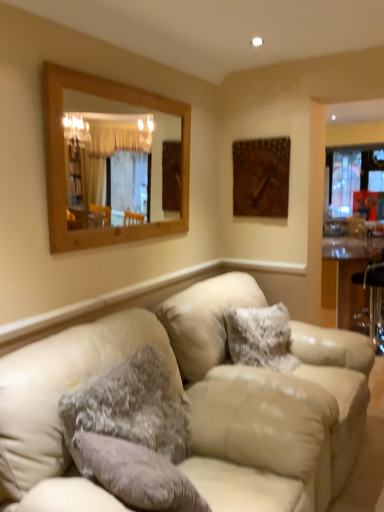
Question: Is brown wooden picture frame at upper right outside fuzzy gray pillow at center, the second pillow from the back?

Choices:
 (A) yes
 (B) no

Answer: (A)

Question: Is brown wooden picture frame at upper right closer to the viewer compared to fuzzy gray pillow at center, placed as the second pillow when sorted from right to left?

Choices:
 (A) yes
 (B) no

Answer: (B)

Question: Is brown wooden picture frame at upper right facing away from fuzzy gray pillow at center, the first pillow in the left-to-right sequence?

Choices:
 (A) no
 (B) yes

Answer: (A)

Question: From a real-world perspective, is brown wooden picture frame at upper right physically below fuzzy gray pillow at center, placed as the second pillow when sorted from right to left?

Choices:
 (A) yes
 (B) no

Answer: (B)

Question: Are brown wooden picture frame at upper right and fuzzy gray pillow at center, which is the first pillow from front to back, far apart?

Choices:
 (A) yes
 (B) no

Answer: (A)

Question: Does brown wooden picture frame at upper right contain fuzzy gray pillow at center, the second pillow from the back?

Choices:
 (A) yes
 (B) no

Answer: (B)

Question: Does fuzzy gray pillow at center, the first pillow in the left-to-right sequence, have a greater width compared to clear glass table at right?

Choices:
 (A) no
 (B) yes

Answer: (A)

Question: Considering the relative sizes of fuzzy gray pillow at center, placed as the second pillow when sorted from right to left, and clear glass table at right in the image provided, is fuzzy gray pillow at center, placed as the second pillow when sorted from right to left, bigger than clear glass table at right?

Choices:
 (A) yes
 (B) no

Answer: (B)

Question: Is fuzzy gray pillow at center, the second pillow from the back, turned away from clear glass table at right?

Choices:
 (A) yes
 (B) no

Answer: (B)

Question: Does fuzzy gray pillow at center, the first pillow in the left-to-right sequence, have a lesser height compared to clear glass table at right?

Choices:
 (A) yes
 (B) no

Answer: (A)

Question: From a real-world perspective, is fuzzy gray pillow at center, the second pillow from the back, below clear glass table at right?

Choices:
 (A) no
 (B) yes

Answer: (A)

Question: From the image's perspective, would you say fuzzy gray pillow at center, which is the first pillow from front to back, is positioned over clear glass table at right?

Choices:
 (A) yes
 (B) no

Answer: (B)

Question: Can you confirm if wooden frame mirror at upper left is wider than brown wooden picture frame at upper right?

Choices:
 (A) yes
 (B) no

Answer: (A)